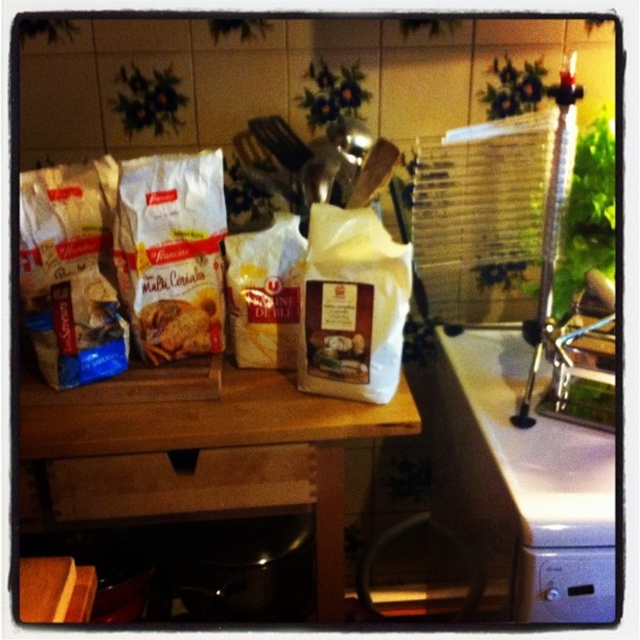
Between white matte bag of flour at center and white matte sack at center, which one appears on the right side from the viewer's perspective?

white matte bag of flour at center

Who is more forward, (342,360) or (278,326)?

Point (342,360) is more forward.

You are a GUI agent. You are given a task and a screenshot of the screen. Output one action in this format:
    pyautogui.click(x=<x>, y=<y>)
    Task: Click on the white matte bag of flour at center
    The image size is (640, 640).
    Given the screenshot: What is the action you would take?
    pyautogui.click(x=353, y=307)

Who is more distant from viewer, (161, 230) or (352, 301)?

Positioned behind is point (161, 230).

Is point (220, 278) farther from camera compared to point (385, 353)?

Yes, it is behind point (385, 353).

Is point (170, 234) farther from camera compared to point (349, 339)?

That is True.

What are the coordinates of `white matte cookie mix at center` in the screenshot? It's located at (172, 253).

Is point (241, 400) less distant than point (285, 292)?

Yes, it is in front of point (285, 292).

Can you confirm if wooden table at center is positioned to the left of white matte sack at center?

Correct, you'll find wooden table at center to the left of white matte sack at center.

Which is behind, point (305, 474) or point (264, 253)?

The point (264, 253) is behind.

This screenshot has height=640, width=640. Find the location of `wooden table at center`. wooden table at center is located at coordinates (202, 458).